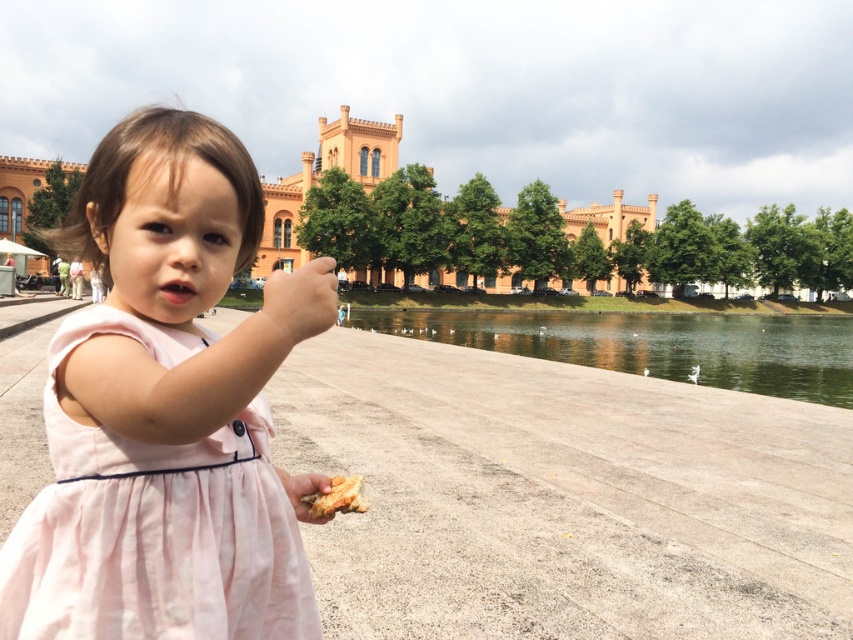
Question: Does pink cotton dress at center appear over golden crispy bread at lower center?

Choices:
 (A) no
 (B) yes

Answer: (B)

Question: Which point is closer to the camera?

Choices:
 (A) pink cotton dress at center
 (B) transparent water at lower center
 (C) golden crispy bread at lower center

Answer: (A)

Question: Which object is closer to the camera taking this photo?

Choices:
 (A) pink cotton dress at center
 (B) transparent water at lower center

Answer: (A)

Question: Is pink cotton dress at center to the left of golden crispy bread at lower center from the viewer's perspective?

Choices:
 (A) no
 (B) yes

Answer: (B)

Question: Which point appears closest to the camera in this image?

Choices:
 (A) (367, 508)
 (B) (711, 339)
 (C) (183, 586)

Answer: (C)

Question: Is the position of pink cotton dress at center more distant than that of golden crispy bread at lower center?

Choices:
 (A) yes
 (B) no

Answer: (B)